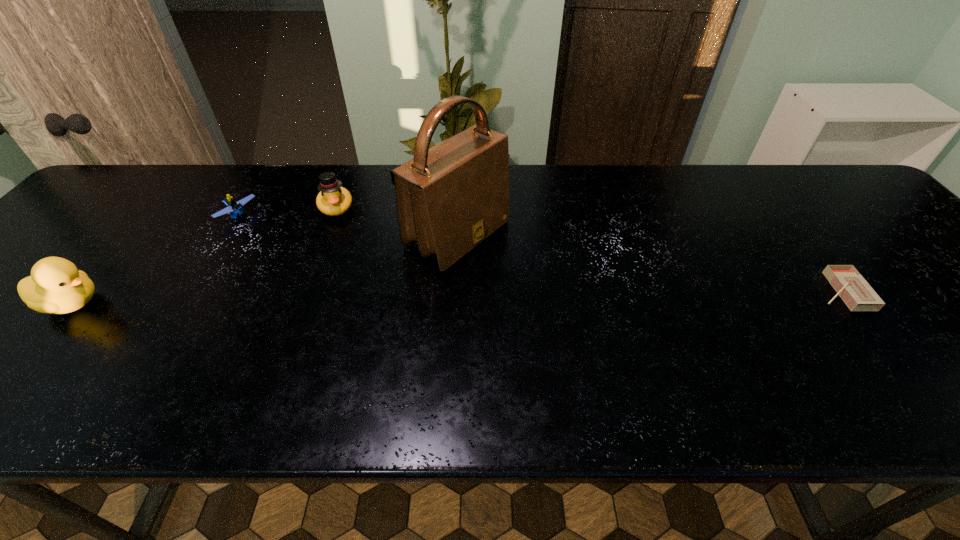
What are the coordinates of `vacant space located 0.130m on the front-facing side of the nearer duck` in the screenshot? It's located at (162, 303).

What are the coordinates of `free space located 0.180m on the striking surface of the matchbox` in the screenshot? It's located at (738, 291).

Locate an element on the screen. The width and height of the screenshot is (960, 540). free space located on the striking surface of the matchbox is located at coordinates (765, 291).

Find the location of a particular element. This screenshot has width=960, height=540. vacant space located on the striking surface of the matchbox is located at coordinates (747, 291).

Image resolution: width=960 pixels, height=540 pixels. I want to click on vacant space located on the front-facing side of the farther duck, so click(343, 251).

Where is `blank space located 0.370m on the front-facing side of the farther duck`? The image size is (960, 540). blank space located 0.370m on the front-facing side of the farther duck is located at coordinates click(357, 328).

Identify the location of blank area located 0.190m on the front-facing side of the farther duck. (347, 270).

Where is `free spot located 0.310m on the front flap of the shoulder bag`? The width and height of the screenshot is (960, 540). free spot located 0.310m on the front flap of the shoulder bag is located at coordinates (615, 327).

Identify the location of vacant space situated 0.080m on the front flap of the shoulder bag. This screenshot has width=960, height=540. (526, 276).

Locate an element on the screen. This screenshot has width=960, height=540. free space located 0.170m on the front flap of the shoulder bag is located at coordinates (559, 294).